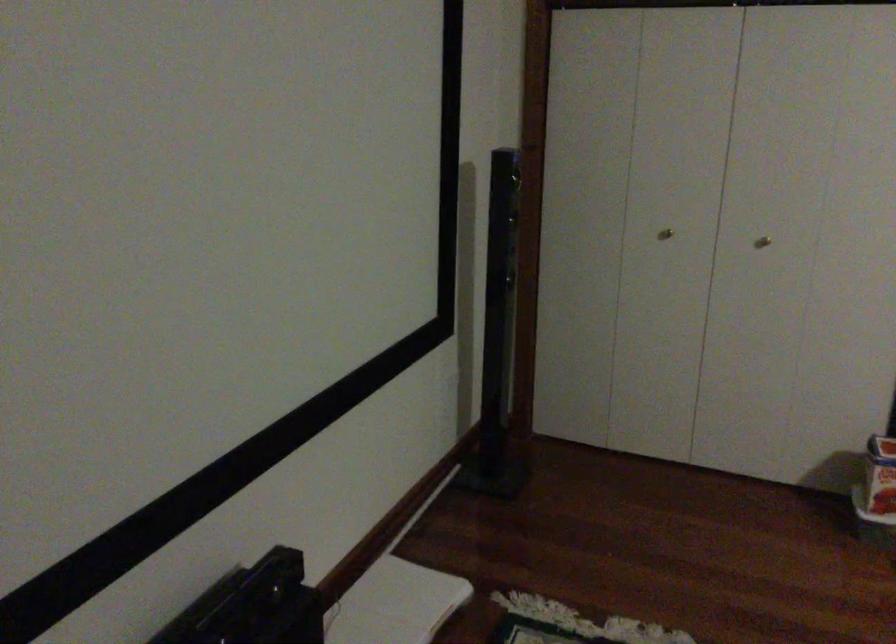
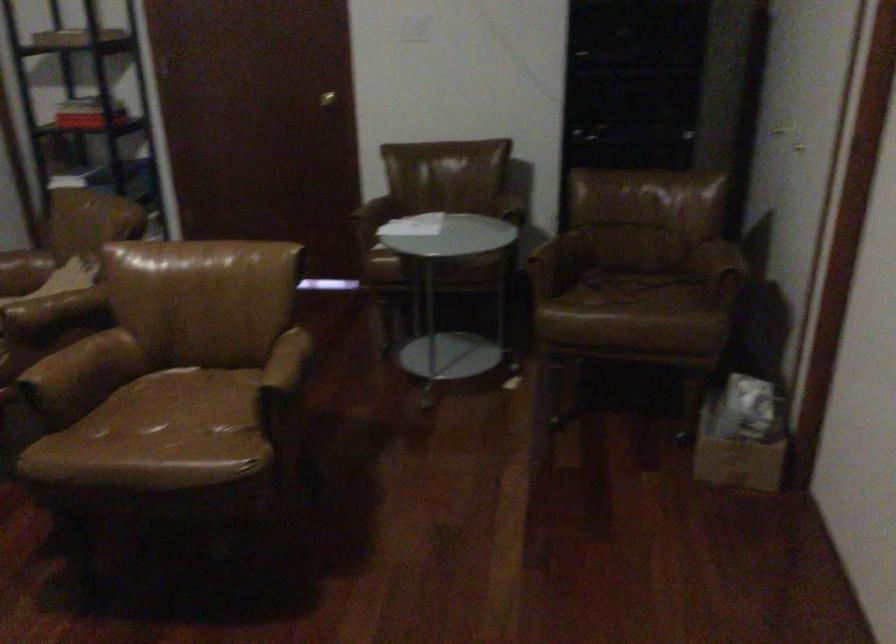
The first image is from the beginning of the video and the second image is from the end. How did the camera likely rotate when shooting the video?

The camera rotated toward right-down.